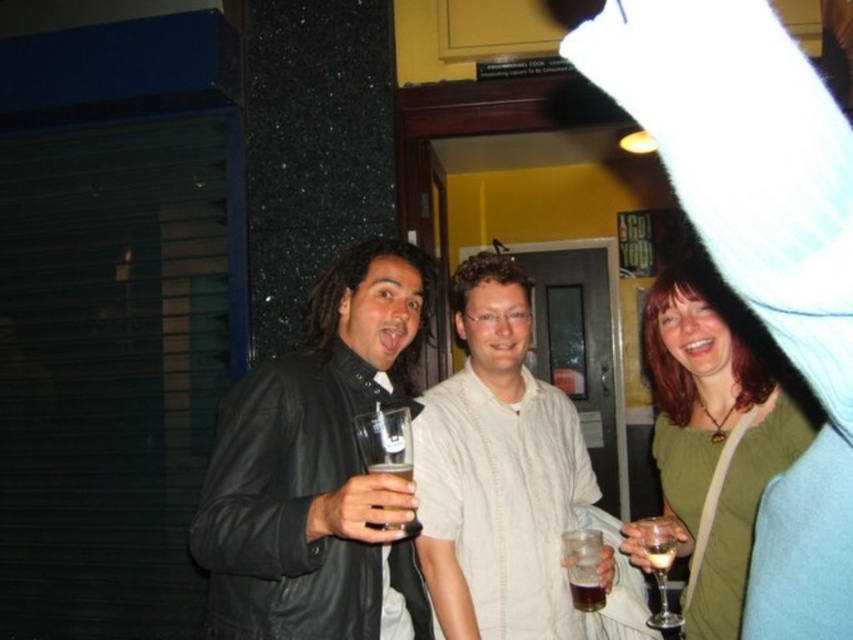
Question: Which point is closer to the camera?

Choices:
 (A) (659, 568)
 (B) (312, 547)
 (C) (666, 566)

Answer: (B)

Question: Is translucent glass at center thinner than dark amber liquid at center?

Choices:
 (A) yes
 (B) no

Answer: (B)

Question: Which point is closer to the camera?

Choices:
 (A) dark amber liquid at center
 (B) white textured shirt at center
 (C) clear glass wine at center

Answer: (C)

Question: Which object is closer to the camera taking this photo?

Choices:
 (A) white textured shirt at center
 (B) translucent glass beer at center

Answer: (B)

Question: Is clear glass wine glass at center positioned in front of translucent glass beer at center?

Choices:
 (A) no
 (B) yes

Answer: (A)

Question: From the image, what is the correct spatial relationship of clear glass wine glass at center in relation to translucent glass beer at center?

Choices:
 (A) left
 (B) right

Answer: (B)